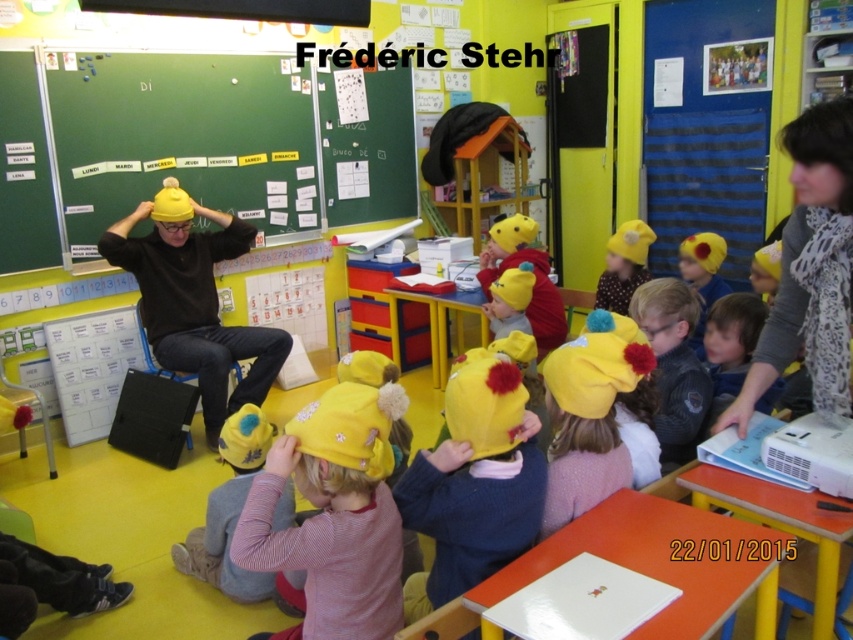
Does matte yellow bulletin board at upper left appear on the right side of yellow fuzzy hat at center?

In fact, matte yellow bulletin board at upper left is to the left of yellow fuzzy hat at center.

Is point (56, 134) farther from viewer compared to point (456, 461)?

Yes, it is.

The width and height of the screenshot is (853, 640). Identify the location of matte yellow bulletin board at upper left. (215, 140).

Consider the image. Does matte yellow bulletin board at upper left lie in front of yellow fuzzy hat at lower center?

No, matte yellow bulletin board at upper left is behind yellow fuzzy hat at lower center.

Is matte yellow bulletin board at upper left bigger than yellow fuzzy hat at lower center?

Correct, matte yellow bulletin board at upper left is larger in size than yellow fuzzy hat at lower center.

Where is `matte yellow bulletin board at upper left`? The width and height of the screenshot is (853, 640). matte yellow bulletin board at upper left is located at coordinates (215, 140).

The height and width of the screenshot is (640, 853). Describe the element at coordinates (474, 484) in the screenshot. I see `yellow fuzzy hat at center` at that location.

Who is positioned more to the left, yellow fuzzy hat at center or matte yellow hat at center?

matte yellow hat at center is more to the left.

You are a GUI agent. You are given a task and a screenshot of the screen. Output one action in this format:
    pyautogui.click(x=<x>, y=<y>)
    Task: Click on the yellow fuzzy hat at center
    Image resolution: width=853 pixels, height=640 pixels.
    Given the screenshot: What is the action you would take?
    pyautogui.click(x=474, y=484)